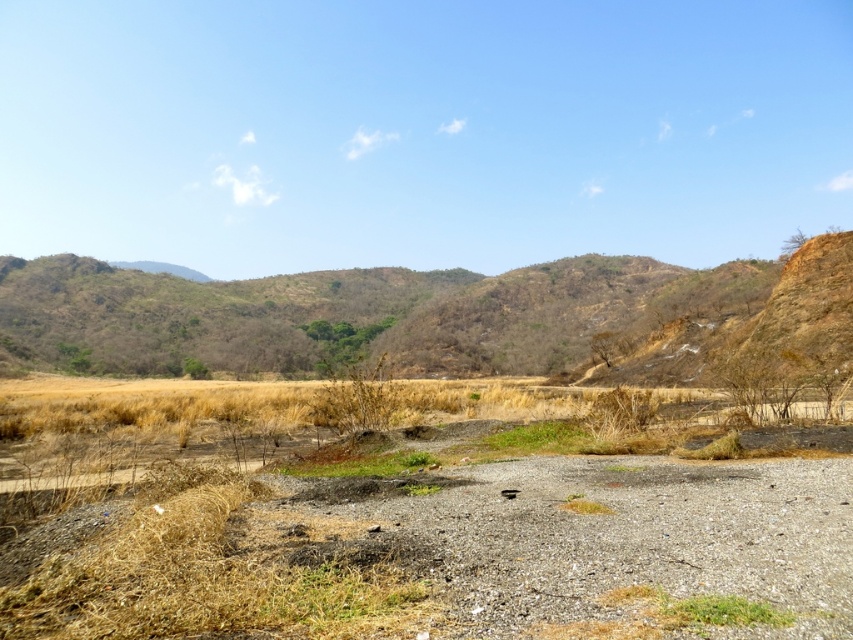
Between brown gravel dirt track at center and green grass at lower center, which one appears on the right side from the viewer's perspective?

From the viewer's perspective, green grass at lower center appears more on the right side.

Is brown gravel dirt track at center above green grass at lower center?

No.

Between point (846, 612) and point (738, 609), which one is positioned in front?

Point (846, 612)

I want to click on brown gravel dirt track at center, so click(584, 541).

From the picture: Does brown gravel dirt track at center appear on the left side of brown/dry grassy hill at center?

No, brown gravel dirt track at center is not to the left of brown/dry grassy hill at center.

What do you see at coordinates (584, 541) in the screenshot? I see `brown gravel dirt track at center` at bounding box center [584, 541].

Find the location of a particular element. This screenshot has width=853, height=640. brown gravel dirt track at center is located at coordinates (584, 541).

Can you confirm if brown/dry grassy hill at center is bigger than green grass at lower center?

Correct, brown/dry grassy hill at center is larger in size than green grass at lower center.

Does brown/dry grassy hill at center have a lesser height compared to green grass at lower center?

No.

Which is in front, point (570, 314) or point (688, 614)?

Point (688, 614) is in front.

Identify the location of brown/dry grassy hill at center. (387, 310).